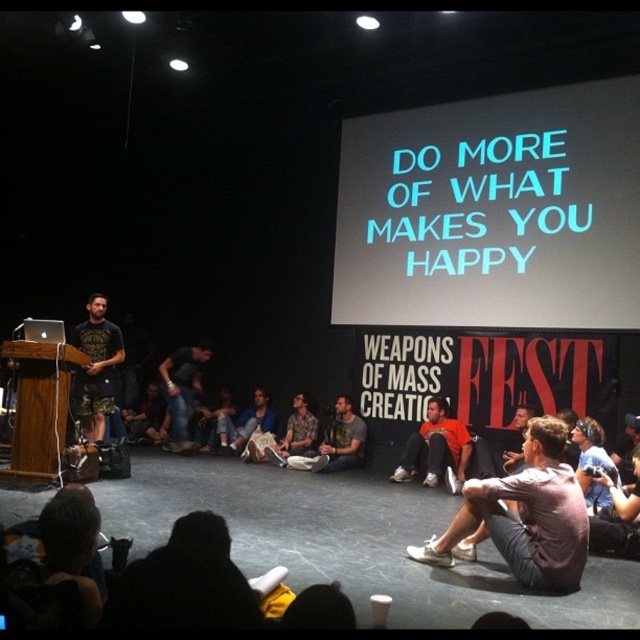
Question: Which is farther from the denim pants at center?

Choices:
 (A) dark green camouflage pants at left
 (B) jeans at center
 (C) orange cotton shirt at center

Answer: (C)

Question: Which object appears closest to the camera in this image?

Choices:
 (A) denim pants at center
 (B) gray fabric shirt at center
 (C) jeans at center
 (D) dark green camouflage pants at left

Answer: (B)

Question: Observing the image, what is the correct spatial positioning of orange cotton shirt at center in reference to denim pants at center?

Choices:
 (A) right
 (B) left

Answer: (A)

Question: Does dark green camouflage pants at left have a larger size compared to orange cotton shirt at center?

Choices:
 (A) yes
 (B) no

Answer: (B)

Question: Which object is farther from the camera taking this photo?

Choices:
 (A) orange cotton shirt at center
 (B) dark green camouflage pants at left
 (C) jeans at center

Answer: (C)

Question: Where is jeans at center located in relation to denim pants at center in the image?

Choices:
 (A) below
 (B) above

Answer: (B)